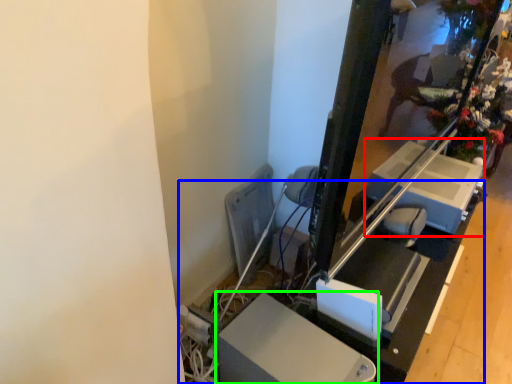
Question: Which is farther away from lift (highlighted by a red box)? table (highlighted by a blue box) or furniture (highlighted by a green box)?

Choices:
 (A) table
 (B) furniture

Answer: (B)